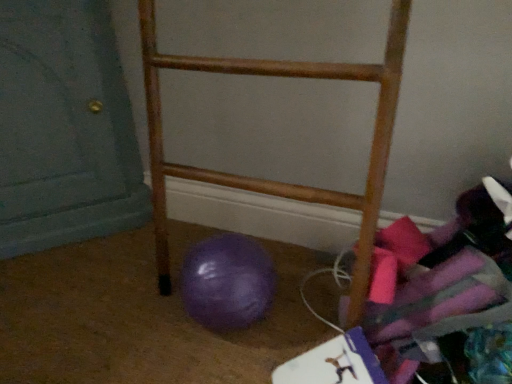
Find the location of `purple rubber ball at lower left`. purple rubber ball at lower left is located at coordinates (227, 282).

Image resolution: width=512 pixels, height=384 pixels. I want to click on purple rubber ball at lower left, so click(227, 282).

How different are the orientations of matte teal door at lower left and purple rubber ball at lower left in degrees?

They differ by 5.55 degrees in their facing directions.

Considering the sizes of objects matte teal door at lower left and purple rubber ball at lower left in the image provided, who is thinner, matte teal door at lower left or purple rubber ball at lower left?

purple rubber ball at lower left.

Is matte teal door at lower left positioned with its back to purple rubber ball at lower left?

No, matte teal door at lower left is not facing away from purple rubber ball at lower left.

Can you confirm if matte teal door at lower left is positioned to the right of purple rubber ball at lower left?

No, matte teal door at lower left is not to the right of purple rubber ball at lower left.

From the image's perspective, is purple rubber ball at lower left above or below wooden rack at center?

Clearly, from the image's perspective, purple rubber ball at lower left is below wooden rack at center.

Considering the relative sizes of purple rubber ball at lower left and wooden rack at center in the image provided, is purple rubber ball at lower left thinner than wooden rack at center?

Yes, purple rubber ball at lower left is thinner than wooden rack at center.

Does purple rubber ball at lower left turn towards wooden rack at center?

Yes, purple rubber ball at lower left is oriented towards wooden rack at center.

Looking at the image, does purple rubber ball at lower left seem bigger or smaller compared to wooden rack at center?

purple rubber ball at lower left is smaller than wooden rack at center.

Considering the sizes of objects wooden rack at center and matte teal door at lower left in the image provided, who is smaller, wooden rack at center or matte teal door at lower left?

With smaller size is wooden rack at center.

From the image's perspective, between wooden rack at center and matte teal door at lower left, who is located below?

From the image's view, wooden rack at center is below.

In the scene shown: Which of these two, wooden rack at center or matte teal door at lower left, is wider?

With larger width is matte teal door at lower left.

Is wooden rack at center facing away from matte teal door at lower left?

No.

Which is less distant, (x=267, y=299) or (x=4, y=150)?

Point (x=267, y=299) is positioned closer to the camera compared to point (x=4, y=150).

In the scene shown: Does purple rubber ball at lower left have a lesser height compared to matte teal door at lower left?

Yes, purple rubber ball at lower left is shorter than matte teal door at lower left.

From the image's perspective, is purple rubber ball at lower left under matte teal door at lower left?

Yes.

What's the angular difference between purple rubber ball at lower left and matte teal door at lower left's facing directions?

There is a 5.55-degree angle between the facing directions of purple rubber ball at lower left and matte teal door at lower left.

Which is behind, wooden rack at center or purple rubber ball at lower left?

purple rubber ball at lower left is behind.

Is purple rubber ball at lower left inside wooden rack at center?

Yes, purple rubber ball at lower left is a part of wooden rack at center.

Considering the sizes of objects wooden rack at center and purple rubber ball at lower left in the image provided, who is smaller, wooden rack at center or purple rubber ball at lower left?

Smaller between the two is purple rubber ball at lower left.

From the image's perspective, which one is positioned higher, matte teal door at lower left or wooden rack at center?

matte teal door at lower left, from the image's perspective.

Would you say matte teal door at lower left is outside wooden rack at center?

Indeed, matte teal door at lower left is completely outside wooden rack at center.

How far apart are matte teal door at lower left and wooden rack at center?

A distance of 35.76 centimeters exists between matte teal door at lower left and wooden rack at center.

Which object is positioned more to the left, matte teal door at lower left or wooden rack at center?

From the viewer's perspective, matte teal door at lower left appears more on the left side.

Find the location of a particular element. Image resolution: width=512 pixels, height=384 pixels. door on the left of purple rubber ball at lower left is located at coordinates (64, 128).

This screenshot has height=384, width=512. Identify the location of furniture above the purple rubber ball at lower left (from the image's perspective). (274, 181).

From the picture: When comparing their distances from matte teal door at lower left, does wooden rack at center or purple rubber ball at lower left seem further?

Based on the image, purple rubber ball at lower left appears to be further to matte teal door at lower left.

Which object lies further to the anchor point matte teal door at lower left, purple rubber ball at lower left or wooden rack at center?

The object further to matte teal door at lower left is purple rubber ball at lower left.

Which object lies nearer to the anchor point purple rubber ball at lower left, matte teal door at lower left or wooden rack at center?

wooden rack at center is positioned closer to the anchor purple rubber ball at lower left.

Considering their positions, is wooden rack at center positioned closer to purple rubber ball at lower left than matte teal door at lower left?

wooden rack at center is closer to purple rubber ball at lower left.

Looking at the image, which one is located further to wooden rack at center, matte teal door at lower left or purple rubber ball at lower left?

matte teal door at lower left lies further to wooden rack at center than the other object.

Based on their spatial positions, is purple rubber ball at lower left or matte teal door at lower left further from wooden rack at center?

matte teal door at lower left is positioned further to the anchor wooden rack at center.

The height and width of the screenshot is (384, 512). Identify the location of ball between matte teal door at lower left and wooden rack at center. (227, 282).